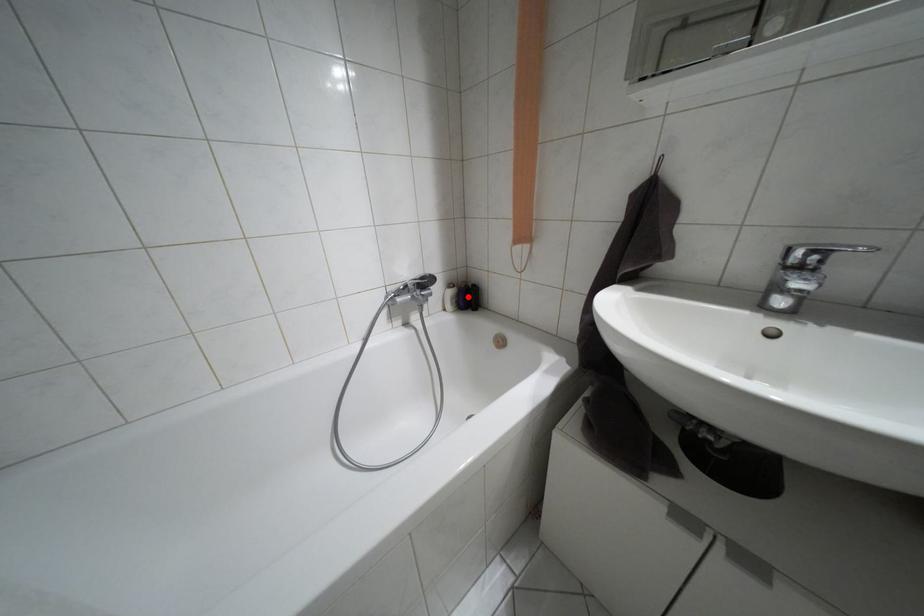
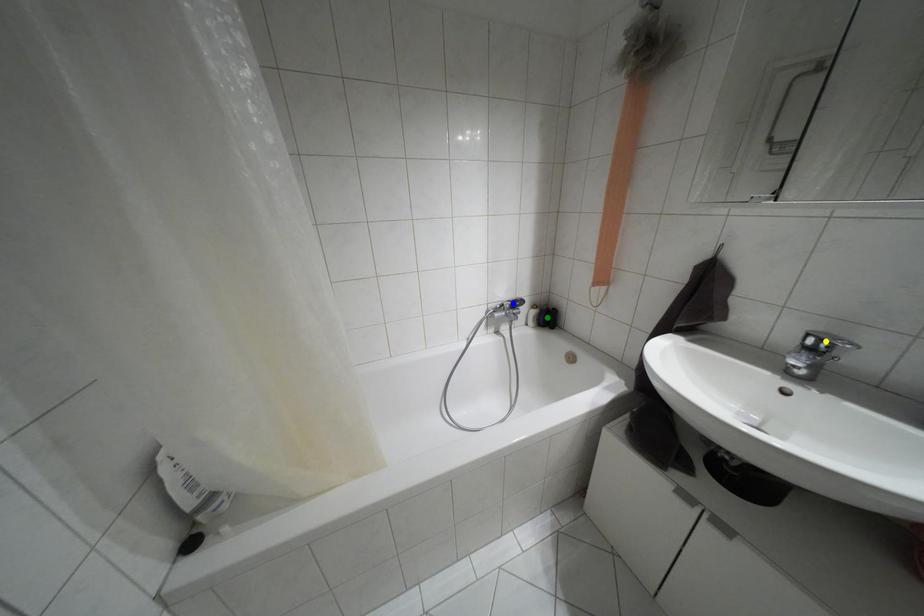
Question: I am providing you with two images of the same scene from different viewpoints. A red point is marked on the first image. You are given multiple points on the second image. Which spot in image 2 lines up with the point in image 1?

Choices:
 (A) yellow point
 (B) green point
 (C) blue point

Answer: (B)